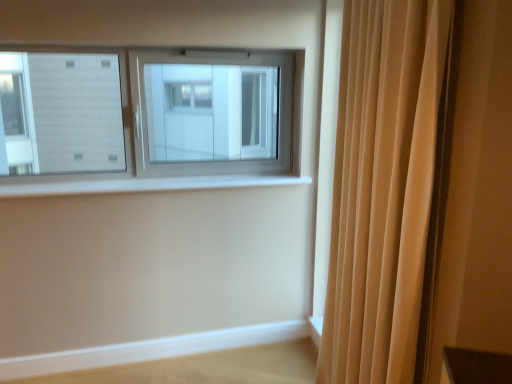
The height and width of the screenshot is (384, 512). I want to click on light wood ledge at lower right, so click(151, 349).

In order to click on beige fabric curtain at right in this screenshot , I will do `click(385, 190)`.

Could light wood ledge at lower right be considered to be inside white smooth window sill at center?

No, light wood ledge at lower right is located outside of white smooth window sill at center.

Considering the relative sizes of white smooth window sill at center and light wood ledge at lower right in the image provided, is white smooth window sill at center shorter than light wood ledge at lower right?

Yes.

Is the position of white smooth window sill at center less distant than that of light wood ledge at lower right?

Yes, white smooth window sill at center is closer to the viewer.

Is white smooth window sill at center not close to light wood ledge at lower right?

No, white smooth window sill at center is not far from light wood ledge at lower right.

Is light wood ledge at lower right closer to the viewer compared to beige fabric curtain at right?

No, light wood ledge at lower right is behind beige fabric curtain at right.

Looking at this image, is light wood ledge at lower right touching beige fabric curtain at right?

No, light wood ledge at lower right is not next to beige fabric curtain at right.

Is light wood ledge at lower right bigger than beige fabric curtain at right?

Incorrect, light wood ledge at lower right is not larger than beige fabric curtain at right.

From the image's perspective, between light wood ledge at lower right and beige fabric curtain at right, which one is located above?

beige fabric curtain at right, from the image's perspective.

Is the depth of beige fabric curtain at right greater than that of light wood ledge at lower right?

No, beige fabric curtain at right is in front of light wood ledge at lower right.

From a real-world perspective, is beige fabric curtain at right positioned above or below light wood ledge at lower right?

beige fabric curtain at right is situated higher than light wood ledge at lower right in the real world.

Does beige fabric curtain at right appear on the left side of light wood ledge at lower right?

In fact, beige fabric curtain at right is to the right of light wood ledge at lower right.

Which of these two, beige fabric curtain at right or light wood ledge at lower right, is smaller?

Smaller between the two is light wood ledge at lower right.

From the picture: Can you confirm if white smooth window sill at center is bigger than beige fabric curtain at right?

Actually, white smooth window sill at center might be smaller than beige fabric curtain at right.

Is white smooth window sill at center situated inside beige fabric curtain at right or outside?

white smooth window sill at center is located beyond the bounds of beige fabric curtain at right.

Measure the distance between white smooth window sill at center and beige fabric curtain at right.

The distance of white smooth window sill at center from beige fabric curtain at right is 3.59 feet.

Considering the positions of objects white smooth window sill at center and beige fabric curtain at right in the image provided, who is more to the right, white smooth window sill at center or beige fabric curtain at right?

beige fabric curtain at right.

Can you confirm if beige fabric curtain at right is shorter than white smooth window sill at center?

No, beige fabric curtain at right is not shorter than white smooth window sill at center.

Which of these two, beige fabric curtain at right or white smooth window sill at center, is bigger?

beige fabric curtain at right is bigger.

Considering the relative sizes of beige fabric curtain at right and white smooth window sill at center in the image provided, is beige fabric curtain at right thinner than white smooth window sill at center?

Yes, beige fabric curtain at right is thinner than white smooth window sill at center.

From a real-world perspective, is light wood ledge at lower right over white smooth window sill at center?

No, from a real-world perspective, light wood ledge at lower right is not over white smooth window sill at center

Is the position of light wood ledge at lower right more distant than that of white smooth window sill at center?

Yes.

Is light wood ledge at lower right far away from white smooth window sill at center?

No, light wood ledge at lower right is not far away from white smooth window sill at center.

You are a GUI agent. You are given a task and a screenshot of the screen. Output one action in this format:
    pyautogui.click(x=<x>, y=<y>)
    Task: Click on the ledge that is under the white smooth window sill at center (from a real-world perspective)
    The height and width of the screenshot is (384, 512).
    Given the screenshot: What is the action you would take?
    pyautogui.click(x=151, y=349)

Identify the location of ledge on the left of beige fabric curtain at right. This screenshot has width=512, height=384. (151, 349).

When comparing their distances from beige fabric curtain at right, does light wood ledge at lower right or white smooth window sill at center seem further?

light wood ledge at lower right is further to beige fabric curtain at right.

Estimate the real-world distances between objects in this image. Which object is further from white smooth window sill at center, light wood ledge at lower right or beige fabric curtain at right?

Based on the image, beige fabric curtain at right appears to be further to white smooth window sill at center.

When comparing their distances from light wood ledge at lower right, does beige fabric curtain at right or white smooth window sill at center seem closer?

white smooth window sill at center.

Considering their positions, is white smooth window sill at center positioned closer to beige fabric curtain at right than light wood ledge at lower right?

Among the two, white smooth window sill at center is located nearer to beige fabric curtain at right.

Looking at the image, which one is located closer to light wood ledge at lower right, white smooth window sill at center or beige fabric curtain at right?

Among the two, white smooth window sill at center is located nearer to light wood ledge at lower right.

Considering their positions, is beige fabric curtain at right positioned closer to white smooth window sill at center than light wood ledge at lower right?

light wood ledge at lower right is positioned closer to the anchor white smooth window sill at center.

This screenshot has width=512, height=384. In order to click on window sill between beige fabric curtain at right and light wood ledge at lower right along the z-axis in this screenshot , I will do `click(148, 185)`.